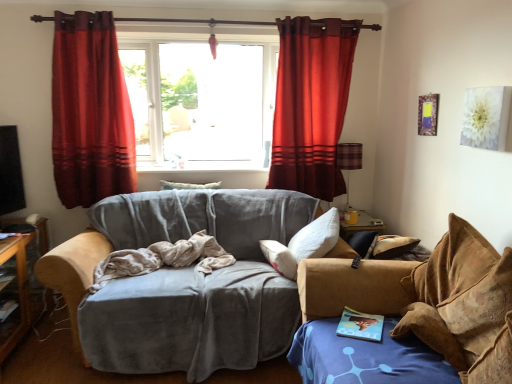
Question: Can you confirm if beige fabric blanket at center is taller than velvet gray couch at center, acting as the 1th studio couch starting from the left?

Choices:
 (A) no
 (B) yes

Answer: (A)

Question: Can you confirm if beige fabric blanket at center is bigger than velvet gray couch at center, the second studio couch viewed from the right?

Choices:
 (A) no
 (B) yes

Answer: (A)

Question: Is beige fabric blanket at center facing towards velvet gray couch at center, acting as the 1th studio couch starting from the left?

Choices:
 (A) yes
 (B) no

Answer: (A)

Question: From a real-world perspective, is beige fabric blanket at center positioned over velvet gray couch at center, the second studio couch viewed from the right, based on gravity?

Choices:
 (A) yes
 (B) no

Answer: (A)

Question: Does beige fabric blanket at center come in front of velvet gray couch at center, acting as the 1th studio couch starting from the left?

Choices:
 (A) yes
 (B) no

Answer: (B)

Question: In terms of height, does plaid fabric lampshade at right look taller or shorter compared to red velvet curtain at left, marked as the first curtain in a left-to-right arrangement?

Choices:
 (A) tall
 (B) short

Answer: (B)

Question: Considering their positions, is plaid fabric lampshade at right located in front of or behind red velvet curtain at left, marked as the first curtain in a left-to-right arrangement?

Choices:
 (A) front
 (B) behind

Answer: (B)

Question: From the image's perspective, is plaid fabric lampshade at right above or below red velvet curtain at left, marked as the first curtain in a left-to-right arrangement?

Choices:
 (A) below
 (B) above

Answer: (A)

Question: In the image, is plaid fabric lampshade at right on the left side or the right side of red velvet curtain at left, arranged as the second curtain when viewed from the right?

Choices:
 (A) right
 (B) left

Answer: (A)

Question: From a real-world perspective, is plaid fabric lampshade at right positioned above or below beige fabric blanket at center?

Choices:
 (A) below
 (B) above

Answer: (B)

Question: Is plaid fabric lampshade at right wider or thinner than beige fabric blanket at center?

Choices:
 (A) thin
 (B) wide

Answer: (A)

Question: From the image's perspective, relative to beige fabric blanket at center, is plaid fabric lampshade at right above or below?

Choices:
 (A) above
 (B) below

Answer: (A)

Question: Based on their sizes in the image, would you say plaid fabric lampshade at right is bigger or smaller than beige fabric blanket at center?

Choices:
 (A) big
 (B) small

Answer: (B)

Question: Is beige fabric blanket at center in front of or behind rich red velvet curtain at upper center, acting as the 1th curtain starting from the right, in the image?

Choices:
 (A) front
 (B) behind

Answer: (A)

Question: Is beige fabric blanket at center bigger or smaller than rich red velvet curtain at upper center, positioned as the 2th curtain in left-to-right order?

Choices:
 (A) small
 (B) big

Answer: (A)